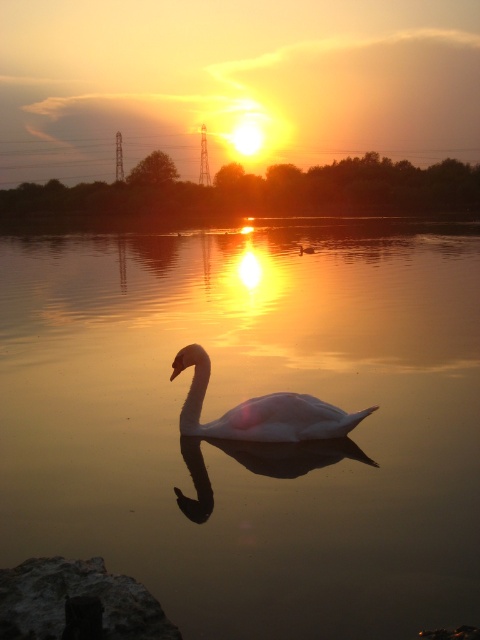
You are standing on a dock observing the sunset scene. You notice the smooth water at center and the white glossy swan at center. Which object is positioned higher in the image?

The smooth water at center is positioned higher than the white glossy swan at center according to the description.

You are standing at the edge of the water and want to place a small decorative stone between the smooth water at center and the gray rough rock at lower left. Can you fit it there if the stone requires 2 meters of space?

The smooth water at center and gray rough rock at lower left are 6.58 meters apart, so yes, you can fit the decorative stone requiring 2 meters of space between them since there is enough distance.

You are an artist trying to paint this sunset scene. You want to ensure the smooth water at center and the gray rough rock at lower left are proportionally accurate. Which object should you make larger in your painting?

The smooth water at center should be made larger in the painting since it is bigger than the gray rough rock at lower left according to the description.